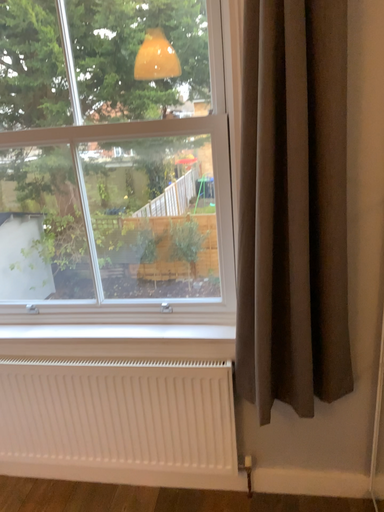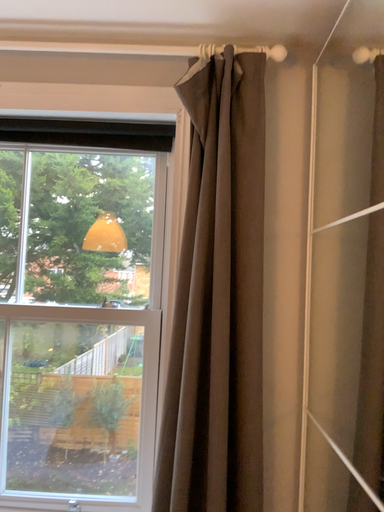
Question: Which way did the camera rotate in the video?

Choices:
 (A) rotated upward
 (B) rotated downward

Answer: (A)